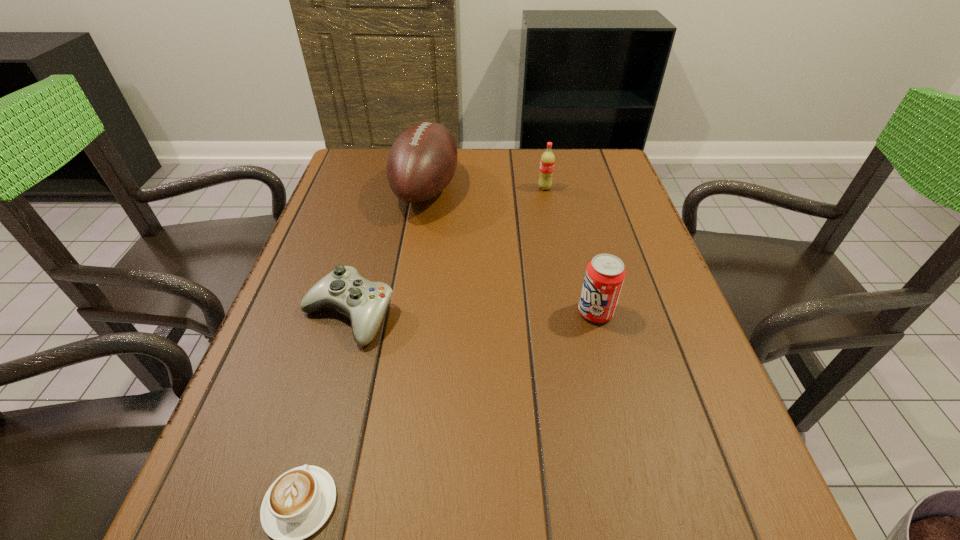
Locate an element on the screen. Image resolution: width=960 pixels, height=540 pixels. vacant space that's between the football (American) and the nearer soda can is located at coordinates (511, 251).

Find the location of a particular element. The image size is (960, 540). unoccupied area between the nearer soda can and the fourth tallest object is located at coordinates (472, 314).

Locate an element on the screen. This screenshot has height=540, width=960. free space that is in between the farther soda can and the nearer soda can is located at coordinates (570, 250).

This screenshot has width=960, height=540. Find the location of `vacant space in between the football (American) and the farther soda can`. vacant space in between the football (American) and the farther soda can is located at coordinates (486, 188).

The height and width of the screenshot is (540, 960). Identify the location of unoccupied area between the control and the nearer soda can. (472, 314).

This screenshot has width=960, height=540. What are the coordinates of `the closest object relative to the nearer soda can` in the screenshot? It's located at (422, 161).

Identify which object is the third closest to the cappuccino. Please provide its 2D coordinates. Your answer should be formatted as a tuple, i.e. [(x, y)], where the tuple contains the x and y coordinates of a point satisfying the conditions above.

[(422, 161)]

At what (x,y) coordinates should I click in order to perform the action: click on vacant region that satisfies the following two spatial constraints: 1. on the back side of the farther soda can; 2. on the left side of the control. Please return your answer as a coordinate pair (x, y). Looking at the image, I should click on (384, 188).